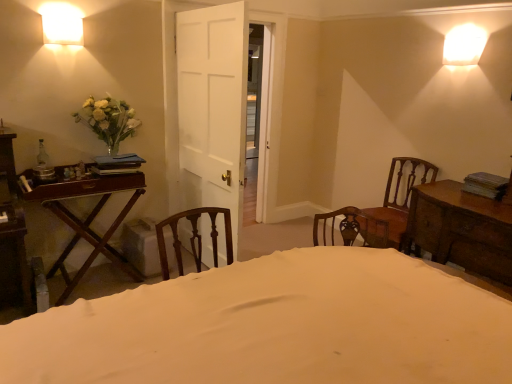
Image resolution: width=512 pixels, height=384 pixels. What do you see at coordinates (401, 195) in the screenshot? I see `wooden chair at right` at bounding box center [401, 195].

You are a GUI agent. You are given a task and a screenshot of the screen. Output one action in this format:
    pyautogui.click(x=<x>, y=<y>)
    Task: Click on the wooden chest of drawers at right, the first table in the right-to-left sequence
    The height and width of the screenshot is (384, 512).
    Given the screenshot: What is the action you would take?
    pyautogui.click(x=461, y=229)

Describe the element at coordinates (461, 229) in the screenshot. I see `wooden chest of drawers at right, the first table in the right-to-left sequence` at that location.

This screenshot has height=384, width=512. Describe the element at coordinates (87, 218) in the screenshot. I see `mahogany wood table at left, the second table from the right` at that location.

Locate an element on the screen. The height and width of the screenshot is (384, 512). wooden chair at right is located at coordinates (401, 195).

In the scene shown: How distant is mahogany wood table at left, the second table from the right, from white matte vase at left?

The distance of mahogany wood table at left, the second table from the right, from white matte vase at left is 22.98 inches.

In the scene shown: Is mahogany wood table at left, the second table from the right, aimed at white matte vase at left?

No, mahogany wood table at left, the second table from the right, is not oriented towards white matte vase at left.

Which object is positioned more to the right, mahogany wood table at left, the second table from the right, or white matte vase at left?

white matte vase at left is more to the right.

Is mahogany wood table at left, the 1th table when ordered from left to right, taller or shorter than wooden chair at right?

Considering their sizes, mahogany wood table at left, the 1th table when ordered from left to right, has less height than wooden chair at right.

Is wooden chair at right located within mahogany wood table at left, the second table from the right?

No.

Is mahogany wood table at left, the 1th table when ordered from left to right, not near wooden chair at right?

That's right, there is a large distance between mahogany wood table at left, the 1th table when ordered from left to right, and wooden chair at right.

From the image's perspective, would you say mahogany wood table at left, the 1th table when ordered from left to right, is shown under wooden chair at right?

Correct, mahogany wood table at left, the 1th table when ordered from left to right, appears lower than wooden chair at right in the image.

Could you tell me if mahogany wood table at left, the second table from the right, is facing white fabric bed at center?

Yes.

Considering the positions of objects mahogany wood table at left, the 1th table when ordered from left to right, and white fabric bed at center in the image provided, who is more to the right, mahogany wood table at left, the 1th table when ordered from left to right, or white fabric bed at center?

From the viewer's perspective, white fabric bed at center appears more on the right side.

Considering the positions of points (117, 219) and (142, 324), is point (117, 219) farther from camera compared to point (142, 324)?

Yes, point (117, 219) is farther from viewer.

Is mahogany wood table at left, the 1th table when ordered from left to right, further to the viewer compared to white fabric bed at center?

Yes.

In the scene shown: Is wooden chair at right spatially inside white glossy wall sconce at upper left, or outside of it?

wooden chair at right exists outside the volume of white glossy wall sconce at upper left.

Is wooden chair at right bigger or smaller than white glossy wall sconce at upper left?

Considering their sizes, wooden chair at right takes up more space than white glossy wall sconce at upper left.

Between point (433, 170) and point (49, 6), which one is positioned behind?

The point (433, 170) is more distant.

Between wooden chest of drawers at right, the second table from the left, and mahogany wood table at left, the 1th table when ordered from left to right, which one is positioned in front?

wooden chest of drawers at right, the second table from the left.

Is mahogany wood table at left, the second table from the right, surrounded by wooden chest of drawers at right, the first table in the right-to-left sequence?

No, mahogany wood table at left, the second table from the right, is not a part of wooden chest of drawers at right, the first table in the right-to-left sequence.

Considering the sizes of objects wooden chest of drawers at right, the first table in the right-to-left sequence, and mahogany wood table at left, the 1th table when ordered from left to right, in the image provided, who is wider, wooden chest of drawers at right, the first table in the right-to-left sequence, or mahogany wood table at left, the 1th table when ordered from left to right,?

wooden chest of drawers at right, the first table in the right-to-left sequence, is wider.

In terms of height, does wooden chest of drawers at right, the second table from the left, look taller or shorter compared to mahogany wood table at left, the second table from the right?

Considering their sizes, wooden chest of drawers at right, the second table from the left, has less height than mahogany wood table at left, the second table from the right.

Considering their positions, is wooden chair at right located in front of or behind white matte vase at left?

wooden chair at right is behind white matte vase at left.

Could you tell me if wooden chair at right is facing white matte vase at left?

No, wooden chair at right is not oriented towards white matte vase at left.

Is white matte vase at left completely or partially inside wooden chair at right?

Definitely not — white matte vase at left is not inside wooden chair at right.

Is wooden chair at right to the left of white matte vase at left from the viewer's perspective?

No, wooden chair at right is not to the left of white matte vase at left.

Is wooden chest of drawers at right, the second table from the left, placed right next to white glossy wall sconce at upper left?

No, wooden chest of drawers at right, the second table from the left, is not beside white glossy wall sconce at upper left.

In terms of height, does wooden chest of drawers at right, the second table from the left, look taller or shorter compared to white glossy wall sconce at upper left?

In the image, wooden chest of drawers at right, the second table from the left, appears to be taller than white glossy wall sconce at upper left.

Between wooden chest of drawers at right, the second table from the left, and white glossy wall sconce at upper left, which one appears on the left side from the viewer's perspective?

From the viewer's perspective, white glossy wall sconce at upper left appears more on the left side.

Could you tell me if wooden chest of drawers at right, the second table from the left, is facing white glossy wall sconce at upper left?

No, wooden chest of drawers at right, the second table from the left, is not facing towards white glossy wall sconce at upper left.

The image size is (512, 384). In order to click on flower above the mahogany wood table at left, the 1th table when ordered from left to right (from the image's perspective) in this screenshot , I will do `click(108, 119)`.

I want to click on the 1st table in front of the wooden chair at right, so click(x=87, y=218).

When comparing their distances from wooden chest of drawers at right, the first table in the right-to-left sequence, does white fabric bed at center or white matte vase at left seem closer?

white fabric bed at center is closer to wooden chest of drawers at right, the first table in the right-to-left sequence.

When comparing their distances from wooden chair at right, does white glossy wall sconce at upper left or white fabric bed at center seem further?

white glossy wall sconce at upper left is further to wooden chair at right.

In the scene shown: Estimate the real-world distances between objects in this image. Which object is closer to white glossy wall sconce at upper left, wooden chest of drawers at right, the second table from the left, or mahogany wood table at left, the 1th table when ordered from left to right?

Among the two, mahogany wood table at left, the 1th table when ordered from left to right, is located nearer to white glossy wall sconce at upper left.

Which object lies nearer to the anchor point wooden chest of drawers at right, the second table from the left, white glossy wall sconce at upper left or mahogany wood table at left, the second table from the right?

The object closer to wooden chest of drawers at right, the second table from the left, is mahogany wood table at left, the second table from the right.

Estimate the real-world distances between objects in this image. Which object is closer to white matte vase at left, mahogany wood table at left, the 1th table when ordered from left to right, or wooden chair at right?

mahogany wood table at left, the 1th table when ordered from left to right, is closer to white matte vase at left.

Which object lies further to the anchor point white glossy wall sconce at upper left, mahogany wood table at left, the second table from the right, or white matte vase at left?

mahogany wood table at left, the second table from the right, lies further to white glossy wall sconce at upper left than the other object.

When comparing their distances from white matte vase at left, does white glossy wall sconce at upper left or white fabric bed at center seem further?

white fabric bed at center lies further to white matte vase at left than the other object.

Considering their positions, is white matte vase at left positioned closer to white fabric bed at center than white glossy wall sconce at upper left?

white matte vase at left is closer to white fabric bed at center.

In order to click on table situated between white glossy wall sconce at upper left and wooden chest of drawers at right, the first table in the right-to-left sequence, from left to right in this screenshot , I will do `click(87, 218)`.

This screenshot has height=384, width=512. Find the location of `chair situated between white glossy wall sconce at upper left and wooden chest of drawers at right, the first table in the right-to-left sequence, from left to right`. chair situated between white glossy wall sconce at upper left and wooden chest of drawers at right, the first table in the right-to-left sequence, from left to right is located at coordinates (401, 195).

You are a GUI agent. You are given a task and a screenshot of the screen. Output one action in this format:
    pyautogui.click(x=<x>, y=<y>)
    Task: Click on the bed between mahogany wood table at left, the 1th table when ordered from left to right, and wooden chest of drawers at right, the first table in the right-to-left sequence, from left to right
    
    Given the screenshot: What is the action you would take?
    pyautogui.click(x=274, y=327)

Locate an element on the screen. flower between mahogany wood table at left, the second table from the right, and wooden chair at right is located at coordinates (108, 119).